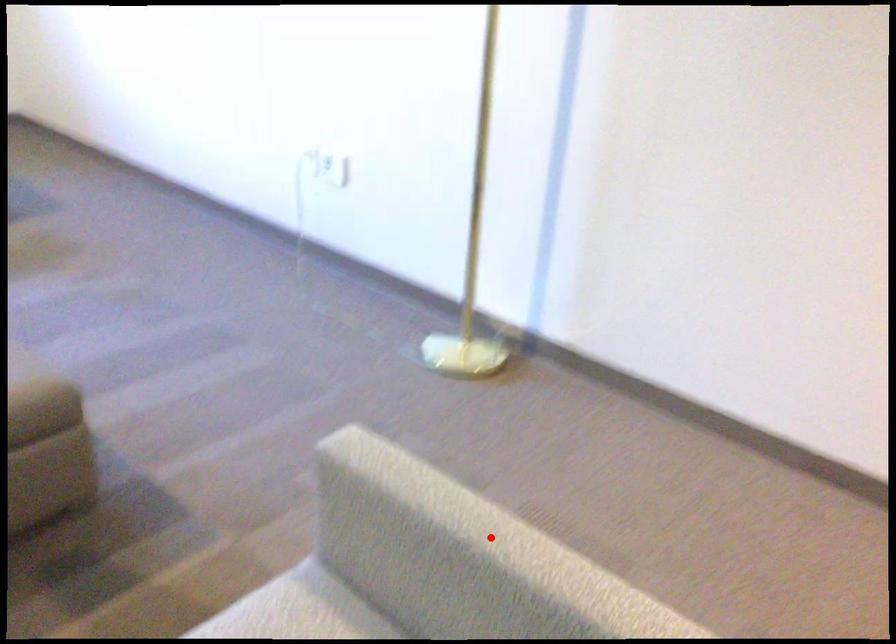
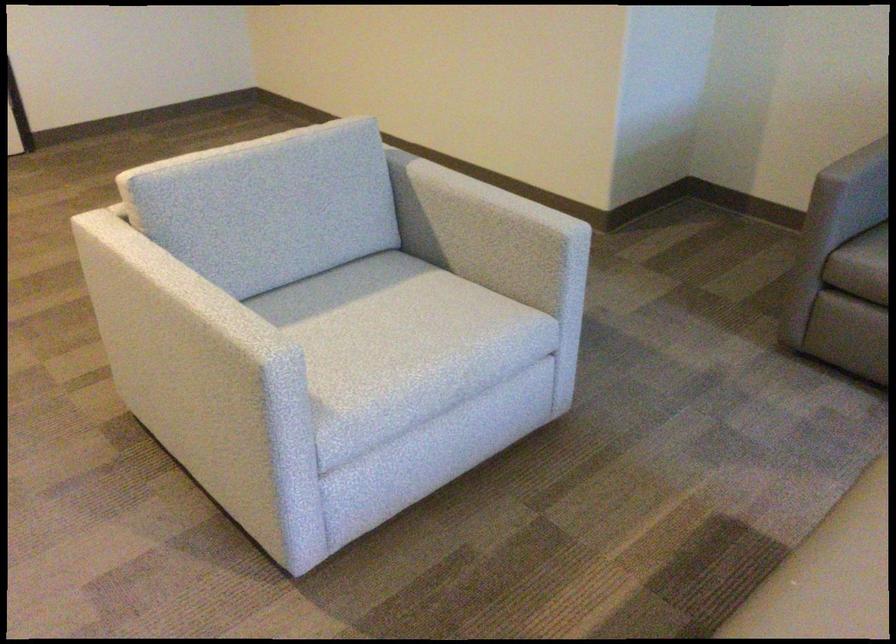
Question: I am providing you with two images of the same scene from different viewpoints. A red point is shown in image1. For the corresponding object point in image2, is it positioned nearer or farther from the camera?

Choices:
 (A) Nearer
 (B) Farther

Answer: (B)